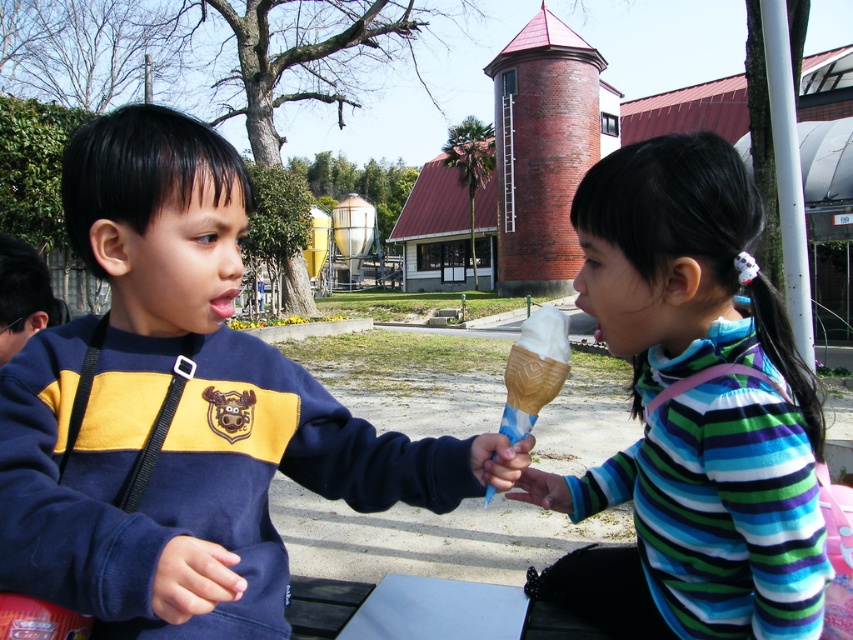
Does matte blue sweatshirt at center appear over vanilla ice cream in waffle cone at center?

Yes.

Does matte blue sweatshirt at center appear on the right side of vanilla ice cream in waffle cone at center?

Incorrect, matte blue sweatshirt at center is not on the right side of vanilla ice cream in waffle cone at center.

Is point (488, 483) less distant than point (543, 324)?

Yes, point (488, 483) is closer to viewer.

What are the coordinates of `matte blue sweatshirt at center` in the screenshot? It's located at (181, 410).

Is the position of white matte ice cream cone at right more distant than that of vanilla ice cream in waffle cone at center?

No, it is not.

Between point (688, 195) and point (532, 358), which one is positioned in front?

Point (688, 195)

Does point (602, 269) come farther from viewer compared to point (555, 349)?

Yes, point (602, 269) is farther from viewer.

The image size is (853, 640). I want to click on white matte ice cream cone at right, so click(x=691, y=412).

Is matte blue sweatshirt at center thinner than white matte ice cream cone at right?

Incorrect, matte blue sweatshirt at center's width is not less than white matte ice cream cone at right's.

The width and height of the screenshot is (853, 640). I want to click on matte blue sweatshirt at center, so click(181, 410).